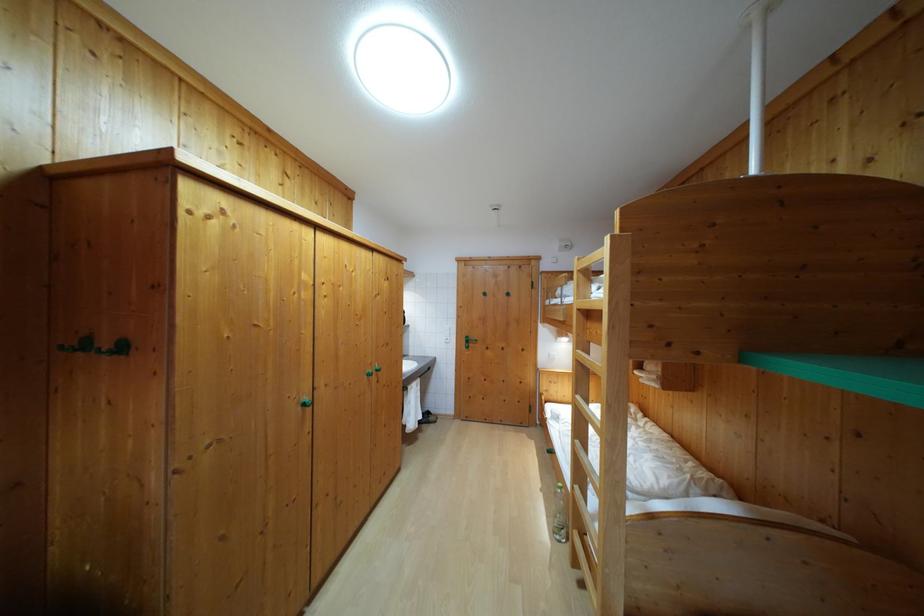
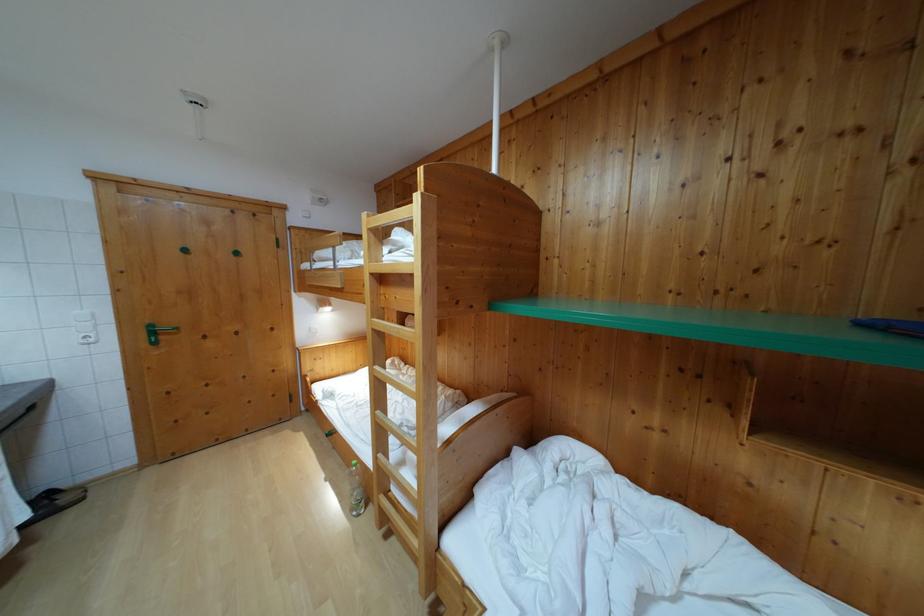
Locate, in the second image, the point that corresponds to (x=489, y=302) in the first image.

(189, 257)